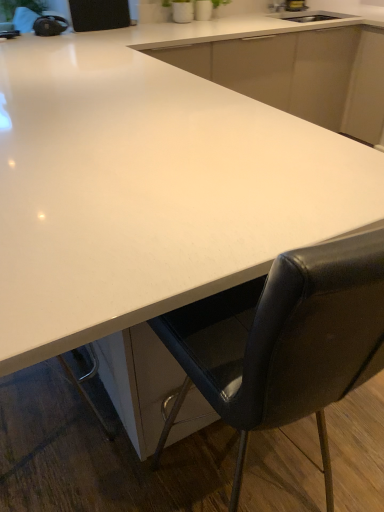
Question: From the image's perspective, is black leather chair at lower right below white glossy countertop at center?

Choices:
 (A) yes
 (B) no

Answer: (A)

Question: Is black leather chair at lower right taller than white glossy countertop at center?

Choices:
 (A) yes
 (B) no

Answer: (A)

Question: Could you tell me if black leather chair at lower right is facing white glossy countertop at center?

Choices:
 (A) yes
 (B) no

Answer: (B)

Question: From a real-world perspective, does black leather chair at lower right sit lower than white glossy countertop at center?

Choices:
 (A) no
 (B) yes

Answer: (B)

Question: Is the surface of black leather chair at lower right in direct contact with white glossy countertop at center?

Choices:
 (A) no
 (B) yes

Answer: (A)

Question: Considering their positions, is black leather chair at lower right located in front of or behind white glossy countertop at center?

Choices:
 (A) behind
 (B) front

Answer: (B)

Question: Is black leather chair at lower right wider or thinner than white glossy countertop at center?

Choices:
 (A) wide
 (B) thin

Answer: (B)

Question: From the image's perspective, is black leather chair at lower right located above or below white glossy countertop at center?

Choices:
 (A) above
 (B) below

Answer: (B)

Question: In terms of height, does black leather chair at lower right look taller or shorter compared to white glossy countertop at center?

Choices:
 (A) short
 (B) tall

Answer: (B)

Question: From the image's perspective, is white glossy countertop at center located above or below white glossy countertop at center?

Choices:
 (A) above
 (B) below

Answer: (A)

Question: Do you think white glossy countertop at center is within white glossy countertop at center, or outside of it?

Choices:
 (A) inside
 (B) outside

Answer: (A)

Question: Looking at the image, does white glossy countertop at center seem bigger or smaller compared to white glossy countertop at center?

Choices:
 (A) small
 (B) big

Answer: (A)

Question: Considering the positions of point (329, 67) and point (203, 201), is point (329, 67) closer or farther from the camera than point (203, 201)?

Choices:
 (A) closer
 (B) farther

Answer: (B)

Question: In terms of width, does black leather chair at lower right look wider or thinner when compared to white glossy countertop at center?

Choices:
 (A) thin
 (B) wide

Answer: (A)

Question: Is black leather chair at lower right spatially inside white glossy countertop at center, or outside of it?

Choices:
 (A) outside
 (B) inside

Answer: (A)